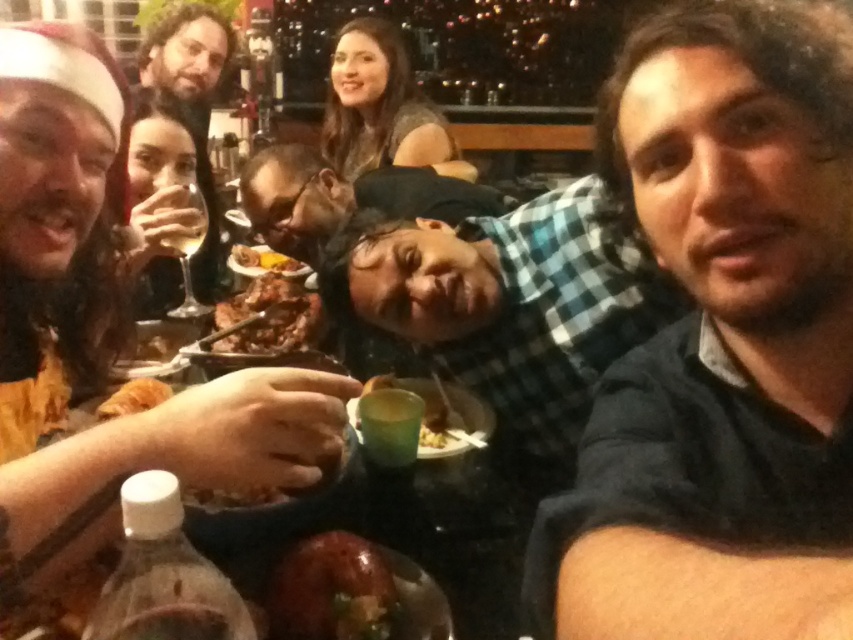
You are a server at the restaurant and need to deliver a dessert plate to the table. The dessert plate is 12 inches in diameter. The table is round with a diameter of 48 inches. There is a checkered fabric shirt at center and a matte black wine glass at upper left. Can you place the dessert plate between them without moving any existing items?

The distance between the checkered fabric shirt at center and the matte black wine glass at upper left is 35.29 inches. Since the dessert plate is 12 inches in diameter, there is enough space between them to place it without moving existing items.

You are standing in the restaurant and want to reach both the point at coordinates point (x=766, y=508) and the point at coordinates point (x=300, y=348). Which point should you move towards first to reach the closer one first?

Point (x=766, y=508) is closer to the viewer than point (x=300, y=348), so you should move towards point (x=766, y=508) first to reach the closer one first.